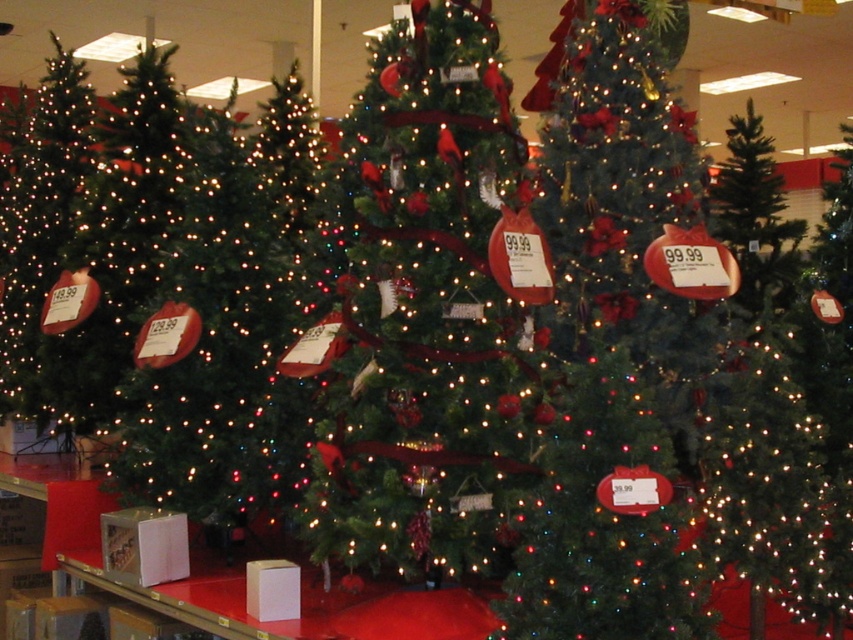
Question: Estimate the real-world distances between objects in this image. Which object is farther from the shiny green christmas tree at left?

Choices:
 (A) shiny green christmas tree at center
 (B) green matte christmas tree at left
 (C) green matte christmas tree at center

Answer: (A)

Question: Which point is closer to the camera taking this photo?

Choices:
 (A) (73, 387)
 (B) (553, 195)
 (C) (465, 131)

Answer: (C)

Question: Is green matte christmas tree at center smaller than shiny green christmas tree at left?

Choices:
 (A) yes
 (B) no

Answer: (A)

Question: Does green matte christmas tree at center have a lesser width compared to shiny green christmas tree at center?

Choices:
 (A) no
 (B) yes

Answer: (B)

Question: Is shiny green christmas tree at center to the right of green matte christmas tree at left from the viewer's perspective?

Choices:
 (A) no
 (B) yes

Answer: (B)

Question: Which point appears closest to the camera in this image?

Choices:
 (A) (572, 451)
 (B) (392, 365)
 (C) (241, 227)
 (D) (62, 193)

Answer: (A)